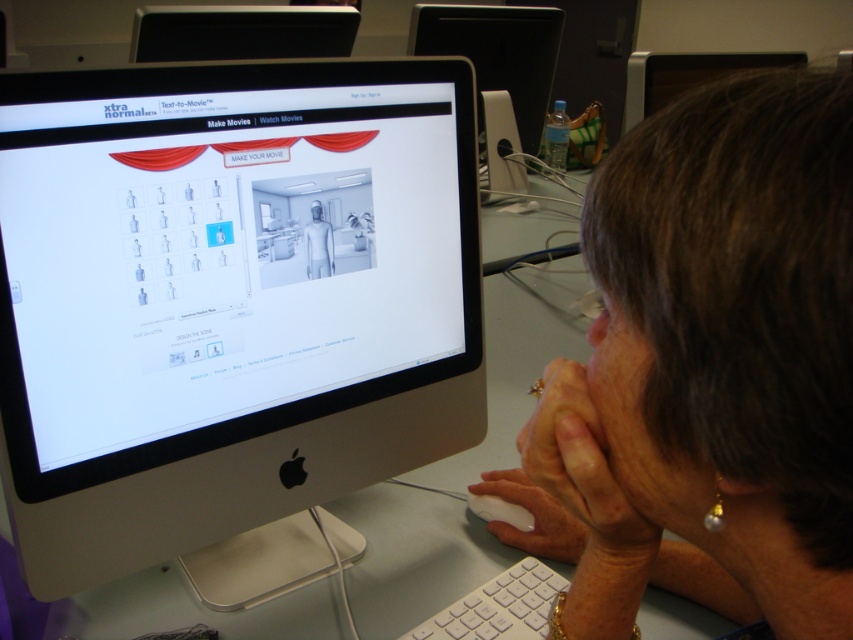
You are standing at the point with coordinates point (x=593, y=436). Looking towards the point with coordinates point (x=84, y=547), would that point be in front of or behind you?

The point (x=84, y=547) is behind point (x=593, y=436), so it would be behind you.

You are a graphic designer working on a project and need to place a new icon on your computer monitor. The icon must be placed exactly at the coordinates point (227, 300). Can you confirm if this point is located on the silver black plastic monitor at center?

Yes, the point (227, 300) corresponds to the silver black plastic monitor at center, so placing the icon there will be accurate.